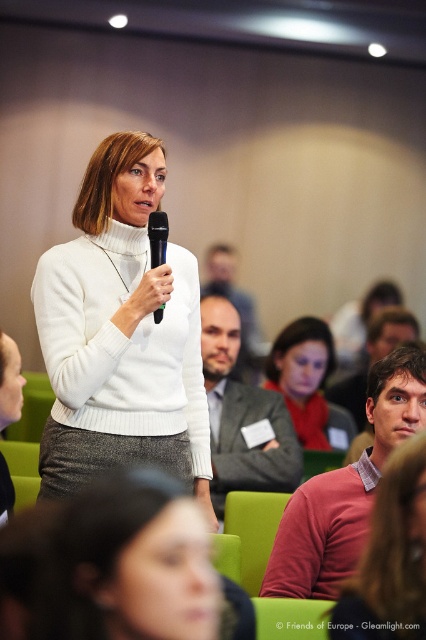
Does gray suit jacket at center come in front of green plastic microphone at center?

No, gray suit jacket at center is further to the viewer.

Between point (284, 416) and point (164, 212), which one is positioned in front?

Point (164, 212) is in front.

The height and width of the screenshot is (640, 426). I want to click on gray suit jacket at center, so click(241, 416).

Does matte white sweater at center have a greater width compared to matte gray sweater at center?

No.

Is matte white sweater at center smaller than matte gray sweater at center?

Yes.

Locate an element on the screen. matte white sweater at center is located at coordinates (391, 556).

Which of these two, matte pink sweater at center or gray suit jacket at center, stands shorter?

matte pink sweater at center

Does matte pink sweater at center appear on the right side of gray suit jacket at center?

Correct, you'll find matte pink sweater at center to the right of gray suit jacket at center.

Who is more forward, (397, 394) or (287, 461)?

Point (397, 394) is in front.

Locate an element on the screen. The width and height of the screenshot is (426, 640). matte pink sweater at center is located at coordinates (345, 490).